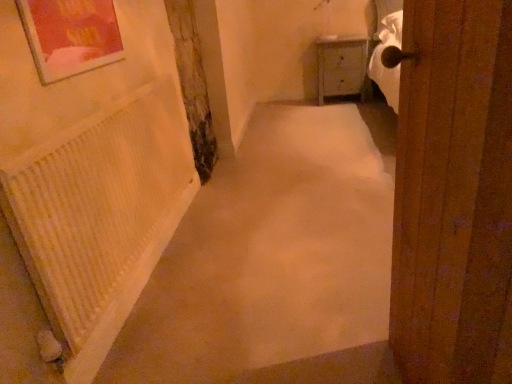
Question: Is white wood cabinet at upper right oriented towards wooden door at right?

Choices:
 (A) yes
 (B) no

Answer: (A)

Question: Does white wood cabinet at upper right appear on the left side of wooden door at right?

Choices:
 (A) no
 (B) yes

Answer: (A)

Question: From a real-world perspective, is white wood cabinet at upper right physically below wooden door at right?

Choices:
 (A) yes
 (B) no

Answer: (A)

Question: From the image's perspective, is white wood cabinet at upper right above wooden door at right?

Choices:
 (A) no
 (B) yes

Answer: (B)

Question: Can you confirm if white wood cabinet at upper right is smaller than wooden door at right?

Choices:
 (A) no
 (B) yes

Answer: (A)

Question: Considering the relative sizes of white wood cabinet at upper right and wooden door at right in the image provided, is white wood cabinet at upper right taller than wooden door at right?

Choices:
 (A) no
 (B) yes

Answer: (A)

Question: Is beige carpet at center to the right of white wood cabinet at upper right from the viewer's perspective?

Choices:
 (A) no
 (B) yes

Answer: (A)

Question: Is beige carpet at center beside white wood cabinet at upper right?

Choices:
 (A) yes
 (B) no

Answer: (B)

Question: Does beige carpet at center lie in front of white wood cabinet at upper right?

Choices:
 (A) yes
 (B) no

Answer: (A)

Question: From a real-world perspective, is beige carpet at center positioned over white wood cabinet at upper right based on gravity?

Choices:
 (A) no
 (B) yes

Answer: (A)

Question: Does beige carpet at center have a greater width compared to white wood cabinet at upper right?

Choices:
 (A) yes
 (B) no

Answer: (A)

Question: Can you confirm if beige carpet at center is smaller than white wood cabinet at upper right?

Choices:
 (A) yes
 (B) no

Answer: (B)

Question: Does white wood cabinet at upper right lie in front of white textured radiator at left?

Choices:
 (A) yes
 (B) no

Answer: (B)